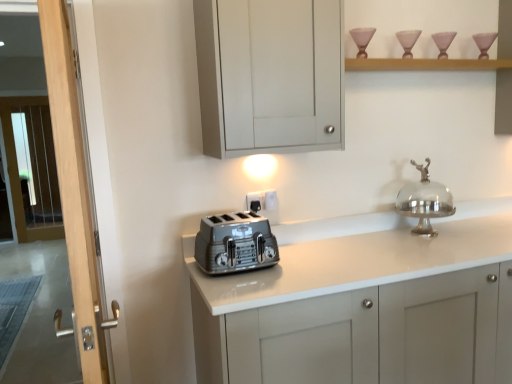
Question: From a real-world perspective, is matte black outlet at center, acting as the first electric outlet starting from the left, located higher than matte gray cabinet at upper center?

Choices:
 (A) no
 (B) yes

Answer: (A)

Question: Would you consider matte black outlet at center, the second electric outlet when ordered from right to left, to be distant from matte gray cabinet at upper center?

Choices:
 (A) no
 (B) yes

Answer: (A)

Question: Is matte black outlet at center, acting as the first electric outlet starting from the left, to the left of matte gray cabinet at upper center from the viewer's perspective?

Choices:
 (A) yes
 (B) no

Answer: (A)

Question: Does matte black outlet at center, acting as the first electric outlet starting from the left, touch matte gray cabinet at upper center?

Choices:
 (A) no
 (B) yes

Answer: (A)

Question: Is matte gray cabinet at upper center at the back of matte black outlet at center, the second electric outlet when ordered from right to left?

Choices:
 (A) yes
 (B) no

Answer: (B)

Question: From a real-world perspective, is clear glass screen door at left, the second screen door when ordered from right to left, physically located above or below white glossy countertop at center?

Choices:
 (A) below
 (B) above

Answer: (B)

Question: Considering the positions of clear glass screen door at left, the 2th screen door from the front, and white glossy countertop at center in the image, is clear glass screen door at left, the 2th screen door from the front, bigger or smaller than white glossy countertop at center?

Choices:
 (A) small
 (B) big

Answer: (A)

Question: Which is correct: clear glass screen door at left, the 2th screen door from the front, is inside white glossy countertop at center, or outside of it?

Choices:
 (A) inside
 (B) outside

Answer: (B)

Question: From the image's perspective, relative to white glossy countertop at center, is clear glass screen door at left, the second screen door when ordered from right to left, above or below?

Choices:
 (A) below
 (B) above

Answer: (B)

Question: Considering the positions of white plastic electric outlet at center, marked as the 2th electric outlet in a left-to-right arrangement, and wooden shelf at upper center in the image, is white plastic electric outlet at center, marked as the 2th electric outlet in a left-to-right arrangement, bigger or smaller than wooden shelf at upper center?

Choices:
 (A) big
 (B) small

Answer: (B)

Question: From a real-world perspective, is white plastic electric outlet at center, marked as the 1th electric outlet in a right-to-left arrangement, positioned above or below wooden shelf at upper center?

Choices:
 (A) above
 (B) below

Answer: (B)

Question: Visually, is white plastic electric outlet at center, marked as the 1th electric outlet in a right-to-left arrangement, positioned to the left or to the right of wooden shelf at upper center?

Choices:
 (A) right
 (B) left

Answer: (B)

Question: Does point (272, 200) appear closer or farther from the camera than point (483, 59)?

Choices:
 (A) farther
 (B) closer

Answer: (B)

Question: Would you say white plastic electric outlet at center, marked as the 1th electric outlet in a right-to-left arrangement, is to the left or to the right of satin silver toaster at center in the picture?

Choices:
 (A) right
 (B) left

Answer: (A)

Question: Looking at the image, does white plastic electric outlet at center, marked as the 1th electric outlet in a right-to-left arrangement, seem bigger or smaller compared to satin silver toaster at center?

Choices:
 (A) small
 (B) big

Answer: (A)